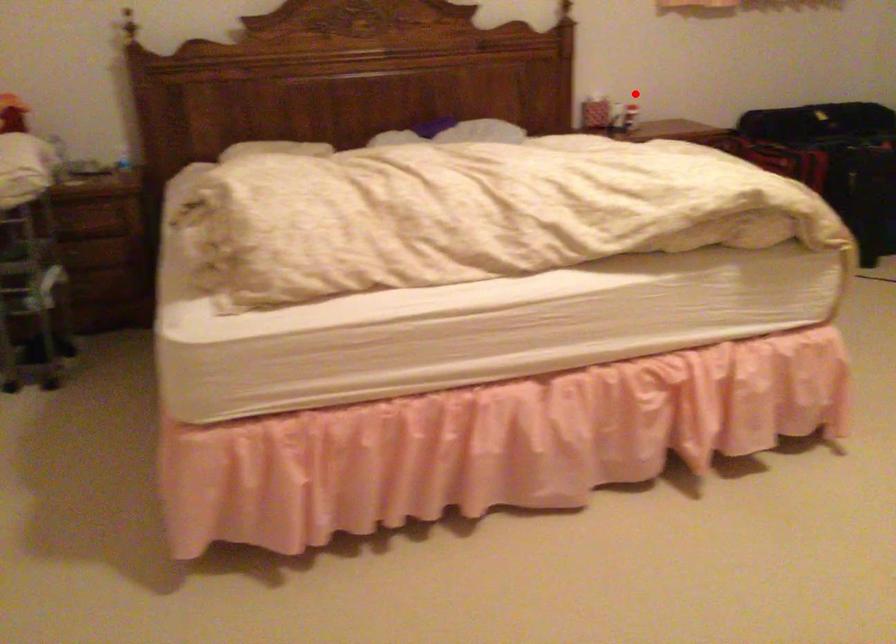
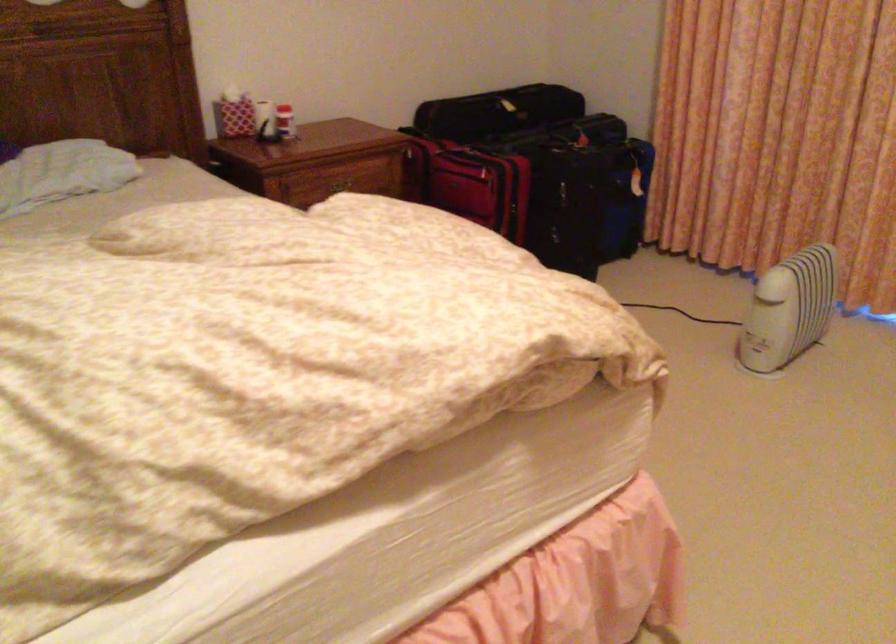
The point at the highlighted location is marked in the first image. Where is the corresponding point in the second image?

(285, 122)